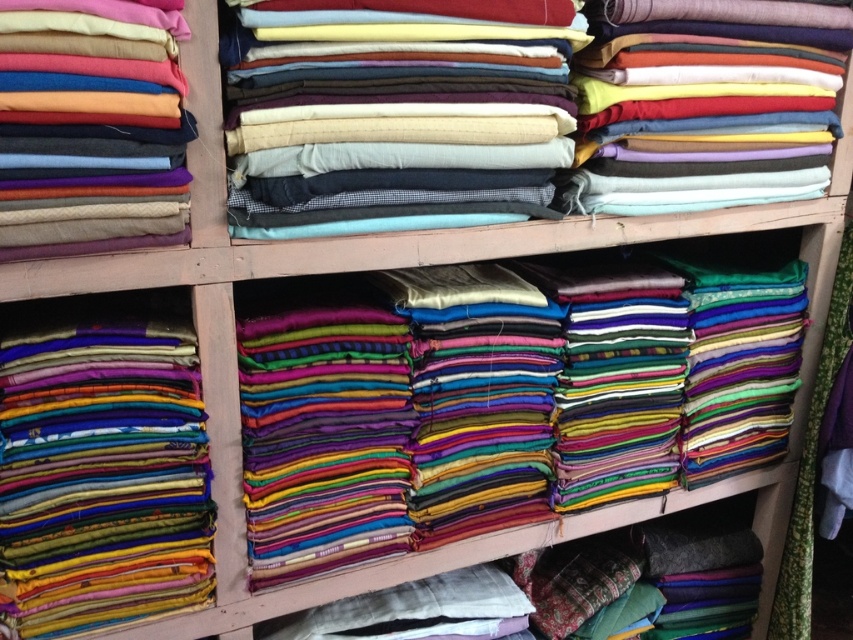
Does matte fabric stack at upper right appear on the right side of matte woolen fabric at left?

Yes, matte fabric stack at upper right is to the right of matte woolen fabric at left.

Is point (630, 172) closer to camera compared to point (74, 173)?

No, (630, 172) is further to viewer.

Find the location of a particular element. matte fabric stack at upper right is located at coordinates (705, 104).

Who is positioned more to the right, shiny silk fabric at lower left or matte fabric stack at upper right?

Positioned to the right is matte fabric stack at upper right.

What are the coordinates of `shiny silk fabric at lower left` in the screenshot? It's located at (102, 476).

Is shiny silk fabric at lower left in front of matte woolen fabric at left?

No, shiny silk fabric at lower left is further to the viewer.

Does shiny silk fabric at lower left appear on the right side of matte woolen fabric at left?

Incorrect, shiny silk fabric at lower left is not on the right side of matte woolen fabric at left.

Measure the distance between shiny silk fabric at lower left and camera.

shiny silk fabric at lower left is 37.79 inches from camera.

Where is `shiny silk fabric at lower left`? shiny silk fabric at lower left is located at coordinates (102, 476).